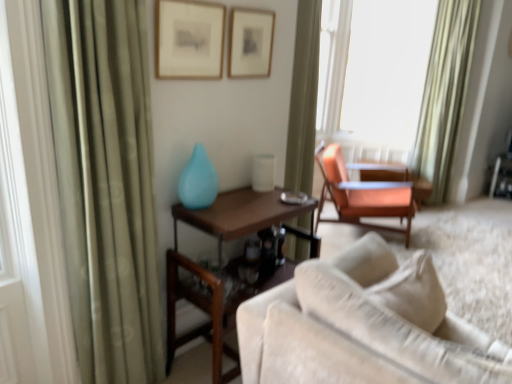
Describe the element at coordinates (245, 217) in the screenshot. The width and height of the screenshot is (512, 384). I see `wooden table at center, arranged as the second table when viewed from the back` at that location.

The height and width of the screenshot is (384, 512). Describe the element at coordinates (362, 194) in the screenshot. I see `orange fabric chair at center` at that location.

This screenshot has height=384, width=512. What do you see at coordinates (362, 324) in the screenshot? I see `beige fabric couch at lower right` at bounding box center [362, 324].

Measure the distance between point (210, 184) and camera.

A distance of 6.40 feet exists between point (210, 184) and camera.

The image size is (512, 384). Describe the element at coordinates (373, 70) in the screenshot. I see `transparent glass window at upper right` at that location.

Where is `wooden table at center, arranged as the second table when viewed from the back`? Image resolution: width=512 pixels, height=384 pixels. wooden table at center, arranged as the second table when viewed from the back is located at coordinates (245, 217).

Can you tell me how much matte orange table at right, the 1th table positioned from the back, and green fabric curtain at left, which is the 2th curtain from back to front, differ in facing direction?

50.9 degrees.

Where is `the 2nd curtain in front of the matte orange table at right, the 2th table in the left-to-right sequence, counting from the anchor's position`? the 2nd curtain in front of the matte orange table at right, the 2th table in the left-to-right sequence, counting from the anchor's position is located at coordinates (106, 184).

Could you tell me if matte orange table at right, the 1th table positioned from the back, is turned towards green fabric curtain at left, which is the 2th curtain in right-to-left order?

Yes, matte orange table at right, the 1th table positioned from the back, is aimed at green fabric curtain at left, which is the 2th curtain in right-to-left order.

Would you say matte orange table at right, the second table positioned from the front, is inside or outside green fabric curtain at left, the first curtain positioned from the left?

matte orange table at right, the second table positioned from the front, is spatially situated outside green fabric curtain at left, the first curtain positioned from the left.

Considering the sizes of objects matte wooden picture frame at upper center, placed as the 2th picture frame when sorted from back to front, and matte gold picture frame at upper center, which ranks as the 1th picture frame in right-to-left order, in the image provided, who is bigger, matte wooden picture frame at upper center, placed as the 2th picture frame when sorted from back to front, or matte gold picture frame at upper center, which ranks as the 1th picture frame in right-to-left order,?

With larger size is matte wooden picture frame at upper center, placed as the 2th picture frame when sorted from back to front.

Is matte wooden picture frame at upper center, the 1th picture frame in the left-to-right sequence, located outside matte gold picture frame at upper center, which ranks as the 1th picture frame in right-to-left order?

Yes, matte wooden picture frame at upper center, the 1th picture frame in the left-to-right sequence, is located beyond the bounds of matte gold picture frame at upper center, which ranks as the 1th picture frame in right-to-left order.

Who is taller, matte wooden picture frame at upper center, the 1th picture frame in the left-to-right sequence, or matte gold picture frame at upper center, the first picture frame when ordered from back to front?

Standing taller between the two is matte wooden picture frame at upper center, the 1th picture frame in the left-to-right sequence.

From a real-world perspective, between matte wooden picture frame at upper center, which is the 1th picture frame from front to back, and matte gold picture frame at upper center, the second picture frame viewed from the front, who is vertically higher?

matte wooden picture frame at upper center, which is the 1th picture frame from front to back, from a real-world perspective.

Can you see matte glass vase at center touching white glossy table lamp at center?

They are not placed beside each other.

In the scene shown: Does matte glass vase at center have a greater height compared to white glossy table lamp at center?

Indeed, matte glass vase at center has a greater height compared to white glossy table lamp at center.

Does point (194, 173) come behind point (253, 187)?

No, it is in front of (253, 187).

Looking at this image, is matte glass vase at center behind white glossy table lamp at center?

No.

Is green satin curtain at upper right, the 2th curtain in the left-to-right sequence, in front of matte gold picture frame at upper center, the second picture frame viewed from the front?

No, it is not.

Considering the relative positions of green satin curtain at upper right, the 2th curtain in the front-to-back sequence, and matte gold picture frame at upper center, the first picture frame when ordered from back to front, in the image provided, is green satin curtain at upper right, the 2th curtain in the front-to-back sequence, to the left of matte gold picture frame at upper center, the first picture frame when ordered from back to front, from the viewer's perspective?

No.

Can you confirm if green satin curtain at upper right, which appears as the 1th curtain when viewed from the right, is taller than matte gold picture frame at upper center, the first picture frame when ordered from back to front?

Yes.

Is matte gold picture frame at upper center, which ranks as the 1th picture frame in right-to-left order, completely or partially inside green satin curtain at upper right, the 2th curtain in the front-to-back sequence?

No, green satin curtain at upper right, the 2th curtain in the front-to-back sequence, does not contain matte gold picture frame at upper center, which ranks as the 1th picture frame in right-to-left order.

Are matte gold picture frame at upper center, the first picture frame when ordered from back to front, and matte orange table at right, the 2th table in the left-to-right sequence, far apart?

matte gold picture frame at upper center, the first picture frame when ordered from back to front, is far away from matte orange table at right, the 2th table in the left-to-right sequence.

Which object is wider, matte gold picture frame at upper center, positioned as the second picture frame in left-to-right order, or matte orange table at right, the second table positioned from the front?

Wider between the two is matte orange table at right, the second table positioned from the front.

Does matte gold picture frame at upper center, the second picture frame viewed from the front, lie behind matte orange table at right, the 1th table positioned from the back?

No, the depth of matte gold picture frame at upper center, the second picture frame viewed from the front, is less than that of matte orange table at right, the 1th table positioned from the back.

Which of these two, matte gold picture frame at upper center, the first picture frame when ordered from back to front, or matte orange table at right, the second table positioned from the front, is bigger?

With larger size is matte orange table at right, the second table positioned from the front.

Is beige fabric couch at lower right next to wooden table at center, which is the 1th table in front-to-back order?

No, beige fabric couch at lower right is not with wooden table at center, which is the 1th table in front-to-back order.

From the image's perspective, relative to wooden table at center, the second table from the right, is beige fabric couch at lower right above or below?

beige fabric couch at lower right is situated lower than wooden table at center, the second table from the right, in the image.

Considering the sizes of objects beige fabric couch at lower right and wooden table at center, which is the 1th table in front-to-back order, in the image provided, who is smaller, beige fabric couch at lower right or wooden table at center, which is the 1th table in front-to-back order,?

wooden table at center, which is the 1th table in front-to-back order.

Can you tell me how much beige fabric couch at lower right and wooden table at center, arranged as the second table when viewed from the back, differ in facing direction?

They differ by 90.7 degrees in their facing directions.

How many degrees apart are the facing directions of green fabric curtain at left, which is the 2th curtain in right-to-left order, and matte orange table at right, the first table viewed from the right?

The angular difference between green fabric curtain at left, which is the 2th curtain in right-to-left order, and matte orange table at right, the first table viewed from the right, is 50.9 degrees.

At what (x,y) coordinates should I click in order to perform the action: click on curtain on the left of the matte orange table at right, the first table viewed from the right. Please return your answer as a coordinate pair (x, y). The width and height of the screenshot is (512, 384). Looking at the image, I should click on (106, 184).

Can you see green fabric curtain at left, which ranks as the first curtain in front-to-back order, touching matte orange table at right, the 1th table positioned from the back?

green fabric curtain at left, which ranks as the first curtain in front-to-back order, and matte orange table at right, the 1th table positioned from the back, are not in contact.

Can you confirm if green fabric curtain at left, the first curtain positioned from the left, is positioned to the left of matte orange table at right, the first table viewed from the right?

Yes, green fabric curtain at left, the first curtain positioned from the left, is to the left of matte orange table at right, the first table viewed from the right.

You are a GUI agent. You are given a task and a screenshot of the screen. Output one action in this format:
    pyautogui.click(x=<x>, y=<y>)
    Task: Click on the table located above the green fabric curtain at left, which ranks as the first curtain in front-to-back order (from the image's perspective)
    The image size is (512, 384).
    Given the screenshot: What is the action you would take?
    pyautogui.click(x=393, y=176)

This screenshot has height=384, width=512. What are the coordinates of `picture frame behind the matte wooden picture frame at upper center, which is the 1th picture frame from front to back` in the screenshot? It's located at (250, 42).

Which object lies further to the anchor point white glossy table lamp at center, matte gold picture frame at upper center, the first picture frame when ordered from back to front, or beige fabric couch at lower right?

Among the two, beige fabric couch at lower right is located further to white glossy table lamp at center.

Looking at the image, which one is located further to matte glass vase at center, matte wooden picture frame at upper center, placed as the 2th picture frame when sorted from back to front, or matte gold picture frame at upper center, which ranks as the 1th picture frame in right-to-left order?

matte gold picture frame at upper center, which ranks as the 1th picture frame in right-to-left order, is positioned further to the anchor matte glass vase at center.

Based on the photo, which object lies nearer to the anchor point wooden table at center, arranged as the second table when viewed from the back, beige fabric couch at lower right or matte gold picture frame at upper center, the second picture frame viewed from the front?

beige fabric couch at lower right is positioned closer to the anchor wooden table at center, arranged as the second table when viewed from the back.

Looking at the image, which one is located further to green fabric curtain at left, which ranks as the first curtain in front-to-back order, matte glass vase at center or orange fabric chair at center?

Based on the image, orange fabric chair at center appears to be further to green fabric curtain at left, which ranks as the first curtain in front-to-back order.

Considering their positions, is green fabric curtain at left, which ranks as the first curtain in front-to-back order, positioned closer to beige fabric couch at lower right than matte gold picture frame at upper center, positioned as the second picture frame in left-to-right order?

The object closer to beige fabric couch at lower right is green fabric curtain at left, which ranks as the first curtain in front-to-back order.

Looking at the image, which one is located closer to matte wooden picture frame at upper center, the 1th picture frame in the left-to-right sequence, matte gold picture frame at upper center, the second picture frame viewed from the front, or green fabric curtain at left, which ranks as the first curtain in front-to-back order?

matte gold picture frame at upper center, the second picture frame viewed from the front, lies closer to matte wooden picture frame at upper center, the 1th picture frame in the left-to-right sequence, than the other object.

Estimate the real-world distances between objects in this image. Which object is closer to matte gold picture frame at upper center, which ranks as the 1th picture frame in right-to-left order, green fabric curtain at left, which ranks as the first curtain in front-to-back order, or orange fabric chair at center?

The object closer to matte gold picture frame at upper center, which ranks as the 1th picture frame in right-to-left order, is green fabric curtain at left, which ranks as the first curtain in front-to-back order.

When comparing their distances from matte gold picture frame at upper center, the first picture frame when ordered from back to front, does matte wooden picture frame at upper center, the 1th picture frame in the left-to-right sequence, or white glossy table lamp at center seem further?

white glossy table lamp at center is further to matte gold picture frame at upper center, the first picture frame when ordered from back to front.

The height and width of the screenshot is (384, 512). I want to click on turquoise between matte wooden picture frame at upper center, placed as the 2th picture frame when sorted from back to front, and beige fabric couch at lower right in the up-down direction, so click(x=198, y=181).

Where is `table lamp positioned between wooden table at center, the second table from the right, and orange fabric chair at center from near to far`? This screenshot has height=384, width=512. table lamp positioned between wooden table at center, the second table from the right, and orange fabric chair at center from near to far is located at coordinates (263, 172).

Where is `chair located between matte wooden picture frame at upper center, which appears as the 2th picture frame when viewed from the right, and transparent glass window at upper right in the depth direction`? The height and width of the screenshot is (384, 512). chair located between matte wooden picture frame at upper center, which appears as the 2th picture frame when viewed from the right, and transparent glass window at upper right in the depth direction is located at coordinates (362, 194).

What are the coordinates of `curtain located between matte gold picture frame at upper center, the second picture frame viewed from the front, and transparent glass window at upper right in the depth direction` in the screenshot? It's located at (445, 92).